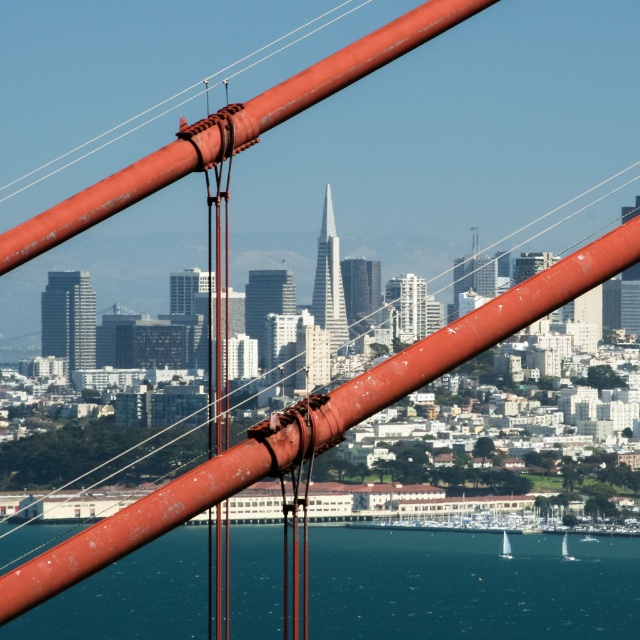
Based on the photo, you are standing on the bridge and want to reach the city located at point (502, 532). If your walking speed is 3 feet per second, how long will it take you to reach the city?

The point (502, 532) is 2170.26 feet away from the viewer. At a walking speed of 3 feet per second, it would take approximately 723.42 seconds, which is about 12 minutes and 3 seconds, to reach the city.

You are a photographer planning to capture the blue water at lower center and the white sailboat at lower center in a single frame. Which object will occupy more horizontal space in the photo?

The blue water at lower center will occupy more horizontal space in the photo because its width surpasses that of the white sailboat at lower center.